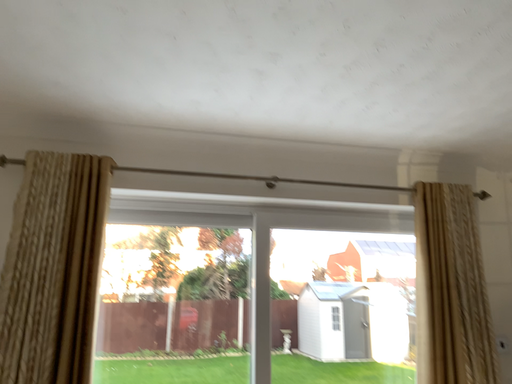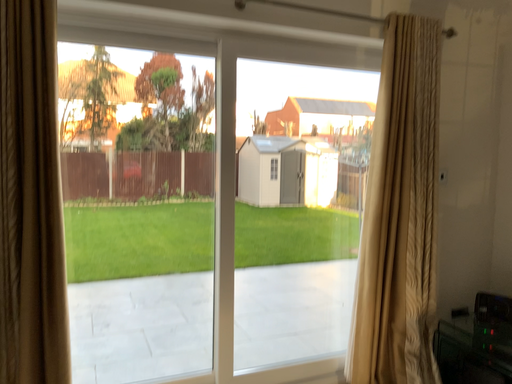
Question: Which way did the camera rotate in the video?

Choices:
 (A) rotated upward
 (B) rotated downward

Answer: (B)